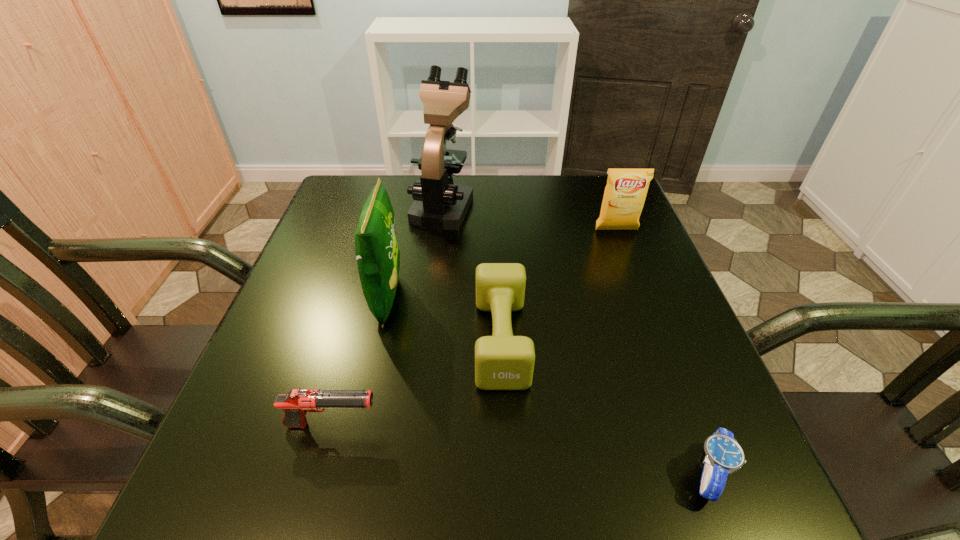
Identify the location of vacant region between the gun and the nearest object. (520, 449).

Identify the location of vacant space that's between the taller crisp (potato chip) and the nearest object. Image resolution: width=960 pixels, height=540 pixels. (548, 386).

I want to click on free space between the shortest object and the fifth farthest object, so click(520, 449).

Find the location of a particular element. free space between the nearer crisp (potato chip) and the dumbbell is located at coordinates point(444,319).

In order to click on free space between the third object from right to left and the third tallest object in this screenshot , I will do `click(559, 285)`.

The width and height of the screenshot is (960, 540). Find the location of `free space between the dumbbell and the shortest object`. free space between the dumbbell and the shortest object is located at coordinates (605, 407).

At what (x,y) coordinates should I click in order to perform the action: click on vacant space that's between the nearest object and the dumbbell. Please return your answer as a coordinate pair (x, y). The width and height of the screenshot is (960, 540). Looking at the image, I should click on (605, 407).

Point out which object is positioned as the nearest to the shortest object. Please provide its 2D coordinates. Your answer should be formatted as a tuple, i.e. [(x, y)], where the tuple contains the x and y coordinates of a point satisfying the conditions above.

[(502, 361)]

Identify which object is the fifth nearest to the dumbbell. Please provide its 2D coordinates. Your answer should be formatted as a tuple, i.e. [(x, y)], where the tuple contains the x and y coordinates of a point satisfying the conditions above.

[(625, 193)]

This screenshot has height=540, width=960. I want to click on free space that satisfies the following two spatial constraints: 1. on the front side of the dumbbell; 2. on the right side of the watch, so [x=507, y=474].